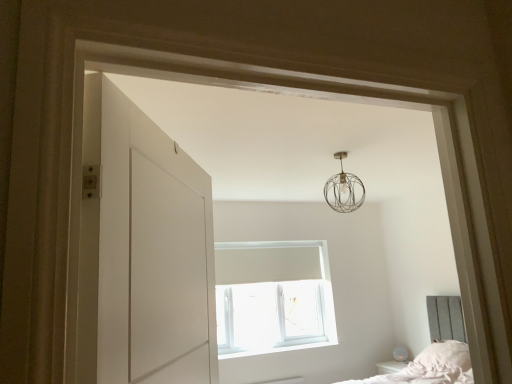
Question: Does white painted wood at lower center have a lesser height compared to metallic wire sphere at upper center?

Choices:
 (A) yes
 (B) no

Answer: (A)

Question: Is white painted wood at lower center positioned behind metallic wire sphere at upper center?

Choices:
 (A) no
 (B) yes

Answer: (B)

Question: Would you consider white painted wood at lower center to be distant from metallic wire sphere at upper center?

Choices:
 (A) yes
 (B) no

Answer: (A)

Question: Is white painted wood at lower center wider than metallic wire sphere at upper center?

Choices:
 (A) no
 (B) yes

Answer: (A)

Question: Is white painted wood at lower center looking in the opposite direction of metallic wire sphere at upper center?

Choices:
 (A) yes
 (B) no

Answer: (B)

Question: Is white painted wood at lower center inside the boundaries of metallic wire sphere at upper center, or outside?

Choices:
 (A) outside
 (B) inside

Answer: (A)

Question: Looking at their shapes, would you say white painted wood at lower center is wider or thinner than metallic wire sphere at upper center?

Choices:
 (A) wide
 (B) thin

Answer: (B)

Question: In terms of height, does white painted wood at lower center look taller or shorter compared to metallic wire sphere at upper center?

Choices:
 (A) tall
 (B) short

Answer: (B)

Question: From a real-world perspective, relative to metallic wire sphere at upper center, is white painted wood at lower center vertically above or below?

Choices:
 (A) above
 (B) below

Answer: (B)

Question: Relative to white plastic window at center, is white painted wood at lower center in front or behind?

Choices:
 (A) front
 (B) behind

Answer: (A)

Question: From a real-world perspective, is white painted wood at lower center above or below white plastic window at center?

Choices:
 (A) above
 (B) below

Answer: (B)

Question: Is white painted wood at lower center bigger or smaller than white plastic window at center?

Choices:
 (A) small
 (B) big

Answer: (A)

Question: In terms of width, does white painted wood at lower center look wider or thinner when compared to white plastic window at center?

Choices:
 (A) wide
 (B) thin

Answer: (A)

Question: Would you say metallic wire sphere at upper center is to the left or to the right of white plastic window at center in the picture?

Choices:
 (A) right
 (B) left

Answer: (A)

Question: Considering the positions of metallic wire sphere at upper center and white plastic window at center in the image, is metallic wire sphere at upper center wider or thinner than white plastic window at center?

Choices:
 (A) thin
 (B) wide

Answer: (B)